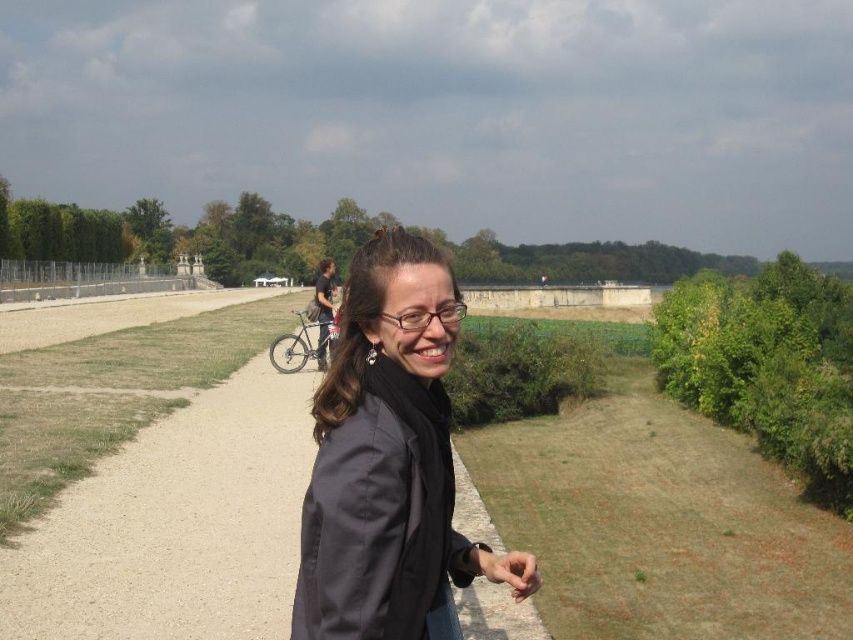
Is smooth gravel path at center thinner than matte black hand at center?

In fact, smooth gravel path at center might be wider than matte black hand at center.

Is smooth gravel path at center shorter than matte black hand at center?

No, smooth gravel path at center is not shorter than matte black hand at center.

Between point (50, 554) and point (537, 588), which one is positioned in front?

Point (537, 588)

Locate an element on the screen. This screenshot has height=640, width=853. smooth gravel path at center is located at coordinates (167, 500).

Which is more to the right, silver metallic bicycle at center or matte black hand at center?

matte black hand at center is more to the right.

Is silver metallic bicycle at center below matte black hand at center?

No.

Locate an element on the screen. This screenshot has width=853, height=640. silver metallic bicycle at center is located at coordinates (300, 344).

Locate an element on the screen. silver metallic bicycle at center is located at coordinates (300, 344).

Is smooth gravel path at center further to the viewer compared to silver metallic bicycle at center?

No.

Which is above, smooth gravel path at center or silver metallic bicycle at center?

Positioned higher is smooth gravel path at center.

The height and width of the screenshot is (640, 853). In order to click on smooth gravel path at center in this screenshot , I will do `click(167, 500)`.

This screenshot has width=853, height=640. I want to click on smooth gravel path at center, so click(x=167, y=500).